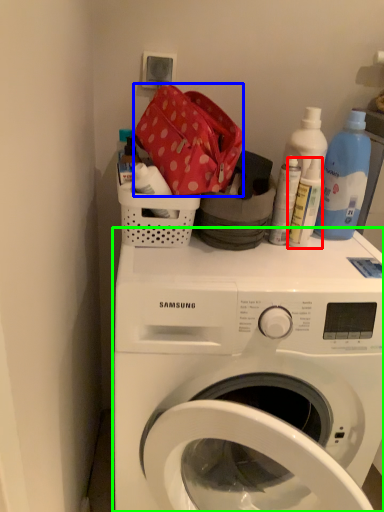
Question: Which is farther away from bottle (highlighted by a red box)? material (highlighted by a blue box) or washing machine (highlighted by a green box)?

Choices:
 (A) material
 (B) washing machine

Answer: (B)